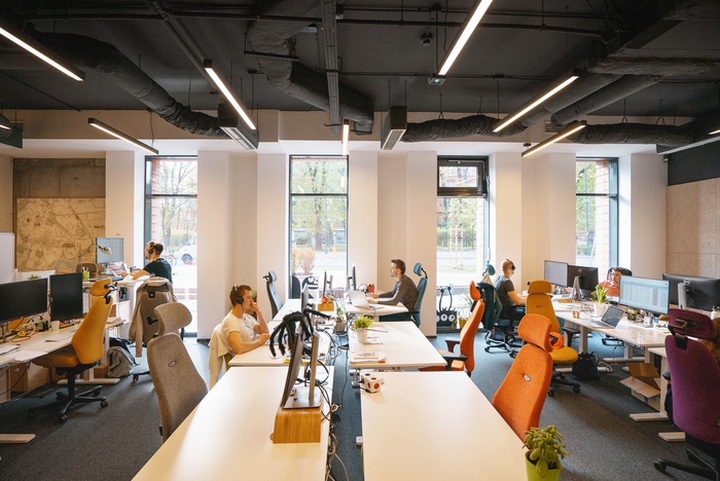
Find the location of a particular element. This screenshot has height=481, width=720. window is located at coordinates (189, 232), (330, 234), (456, 237), (593, 222).